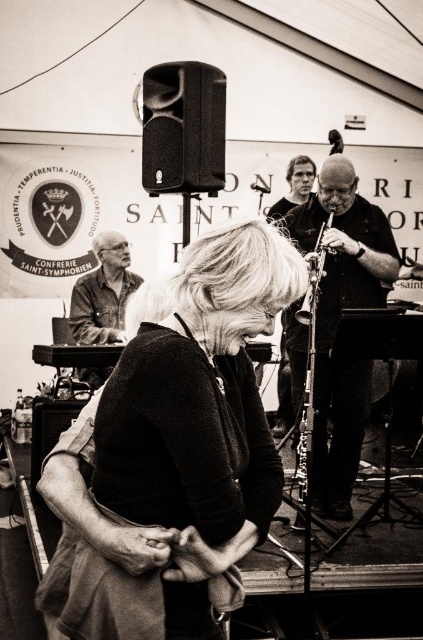
Question: Does matte black sweater at center appear on the right side of matte black shirt at left?

Choices:
 (A) yes
 (B) no

Answer: (A)

Question: Which object is positioned farthest from the metallic silver flute at center?

Choices:
 (A) matte black shirt at left
 (B) smooth black clarinet at center
 (C) matte black sweater at center

Answer: (A)

Question: Is matte black sweater at center below matte black shirt at left?

Choices:
 (A) yes
 (B) no

Answer: (A)

Question: Which point is farther to the camera?

Choices:
 (A) matte black sweater at center
 (B) matte black shirt at left

Answer: (B)

Question: In this image, where is matte black sweater at center located relative to smooth black clarinet at center?

Choices:
 (A) left
 (B) right

Answer: (A)

Question: Estimate the real-world distances between objects in this image. Which object is closer to the matte black sweater at center?

Choices:
 (A) metallic silver flute at center
 (B) smooth black clarinet at center

Answer: (A)